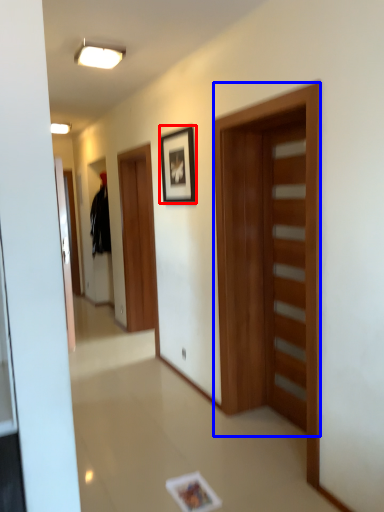
Question: Which of the following is the closest to the observer, picture frame (highlighted by a red box) or door (highlighted by a blue box)?

Choices:
 (A) picture frame
 (B) door

Answer: (B)